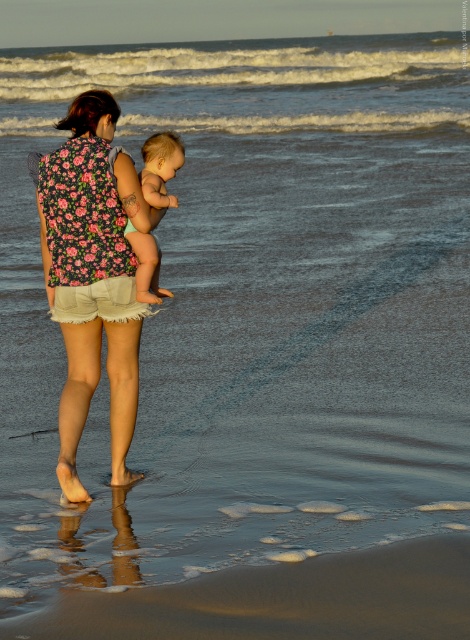
This screenshot has height=640, width=470. Find the location of `sandy brown at lower center`. sandy brown at lower center is located at coordinates (281, 600).

Is sandy brown at lower center positioned before floral fabric top at center?

That is True.

Is point (116, 621) farther from camera compared to point (101, 243)?

No.

What are the coordinates of `sandy brown at lower center` in the screenshot? It's located at (281, 600).

Between floral fabric top at center and soft beige skin at center, which one appears on the right side from the viewer's perspective?

Positioned to the right is soft beige skin at center.

Identify the location of floral fabric top at center. (88, 202).

Locate an element on the screen. The width and height of the screenshot is (470, 640). floral fabric top at center is located at coordinates (88, 202).

Is sandy brown at lower center shorter than soft beige skin at center?

Yes.

Who is taller, sandy brown at lower center or soft beige skin at center?

soft beige skin at center is taller.

Between point (461, 604) and point (148, 232), which one is positioned in front?

Point (461, 604)

Where is `sandy brown at lower center`? sandy brown at lower center is located at coordinates (281, 600).